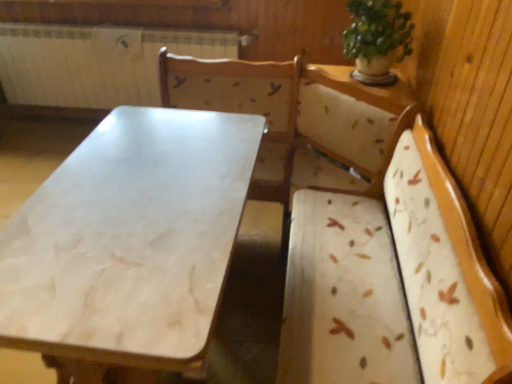
Question: From a real-world perspective, is white painted metal radiator at upper left under green leafy plant at upper right?

Choices:
 (A) no
 (B) yes

Answer: (B)

Question: Is white painted metal radiator at upper left oriented away from green leafy plant at upper right?

Choices:
 (A) yes
 (B) no

Answer: (B)

Question: From the image's perspective, is white painted metal radiator at upper left beneath green leafy plant at upper right?

Choices:
 (A) no
 (B) yes

Answer: (A)

Question: Is white painted metal radiator at upper left positioned beyond the bounds of green leafy plant at upper right?

Choices:
 (A) no
 (B) yes

Answer: (B)

Question: Does white painted metal radiator at upper left have a greater width compared to green leafy plant at upper right?

Choices:
 (A) no
 (B) yes

Answer: (A)

Question: Is white painted metal radiator at upper left to the left of green leafy plant at upper right from the viewer's perspective?

Choices:
 (A) yes
 (B) no

Answer: (A)

Question: Does green leafy plant at upper right have a lesser width compared to white marble table at center?

Choices:
 (A) no
 (B) yes

Answer: (B)

Question: Could you tell me if green leafy plant at upper right is turned towards white marble table at center?

Choices:
 (A) no
 (B) yes

Answer: (A)

Question: Considering the relative sizes of green leafy plant at upper right and white marble table at center in the image provided, is green leafy plant at upper right shorter than white marble table at center?

Choices:
 (A) yes
 (B) no

Answer: (A)

Question: Is green leafy plant at upper right turned away from white marble table at center?

Choices:
 (A) no
 (B) yes

Answer: (A)

Question: From the image's perspective, does green leafy plant at upper right appear lower than white marble table at center?

Choices:
 (A) yes
 (B) no

Answer: (B)

Question: Is green leafy plant at upper right not close to white marble table at center?

Choices:
 (A) no
 (B) yes

Answer: (A)

Question: Does white marble table at center contain green leafy plant at upper right?

Choices:
 (A) yes
 (B) no

Answer: (B)